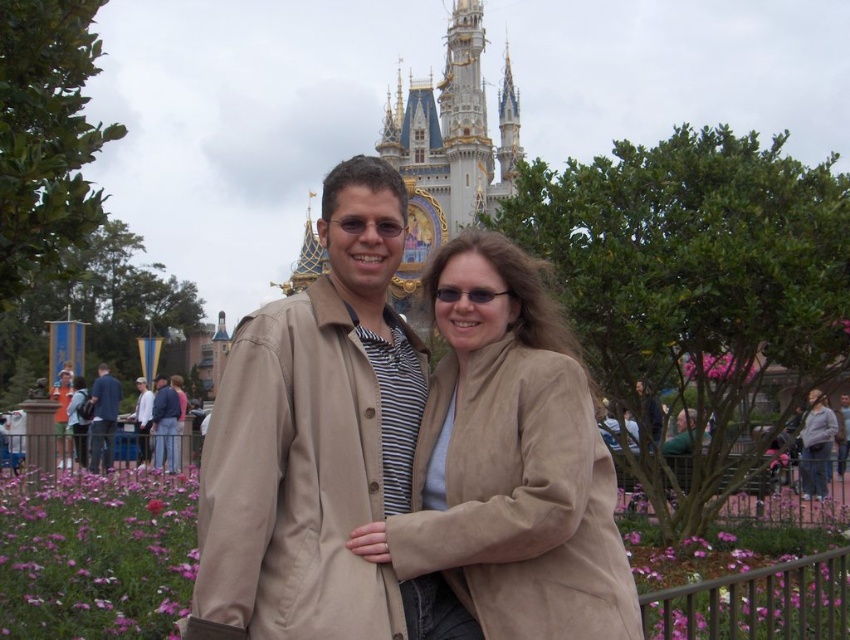
You are a photographer at the theme park and need to determine which item in the image takes up more space in the frame. Based on the scene, which is larger in size between the tan fabric coat at center and the blue denim jeans at center?

The tan fabric coat at center is bigger than the blue denim jeans at center, so the tan fabric coat at center takes up more space in the frame.

You are a photographer trying to capture the two points in the image. Which point is closer to you, point (371, 339) or point (500, 397)?

Point (371, 339) is further to the viewer than point (500, 397). Wait, that seems contradictory. Let me check the description again. Oh, the Objects Description says point (371, 339) is further to the viewer than point (500, 397). So actually, point (500, 397) is closer to the viewer. Therefore, the answer is point (500, 397) is closer to you.